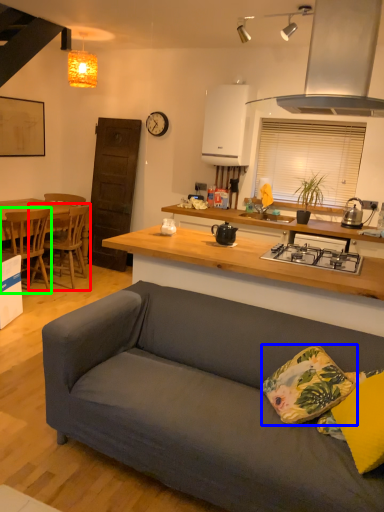
Question: Which is nearer to the chair (highlighted by a red box)? pillow (highlighted by a blue box) or chair (highlighted by a green box).

Choices:
 (A) pillow
 (B) chair

Answer: (B)